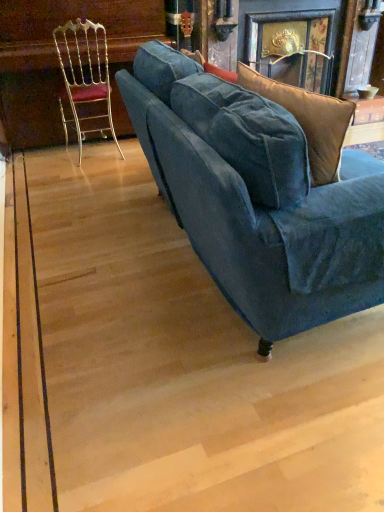
Question: Is gold metallic chair at left in front of or behind wooden table at upper right in the image?

Choices:
 (A) front
 (B) behind

Answer: (A)

Question: Considering the positions of gold metallic chair at left and wooden table at upper right in the image, is gold metallic chair at left taller or shorter than wooden table at upper right?

Choices:
 (A) short
 (B) tall

Answer: (B)

Question: Which object is positioned closest to the wooden table at upper right?

Choices:
 (A) velvet blue couch at center
 (B) gold metallic chair at left

Answer: (B)

Question: Which of these objects is positioned closest to the gold metallic chair at left?

Choices:
 (A) wooden table at upper right
 (B) velvet blue couch at center

Answer: (B)